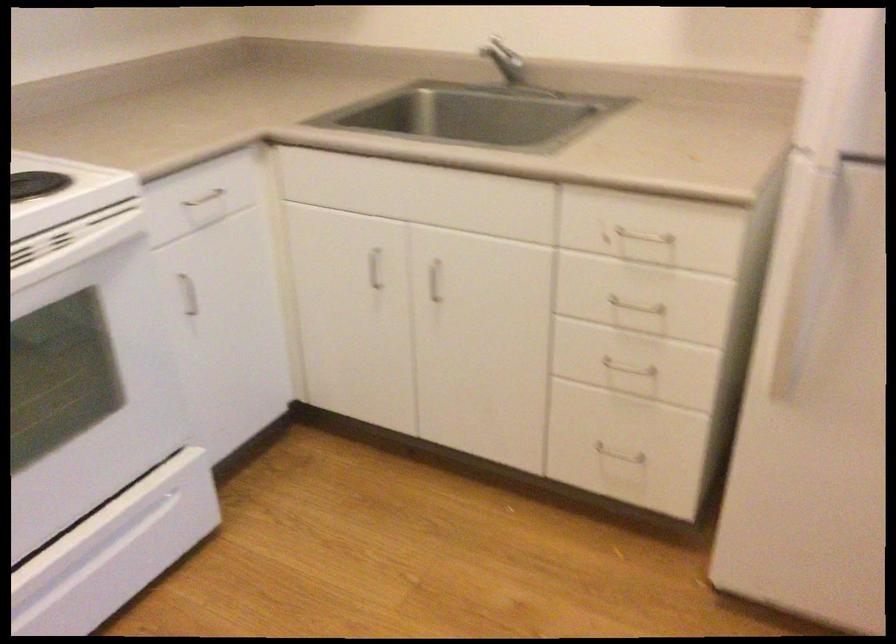
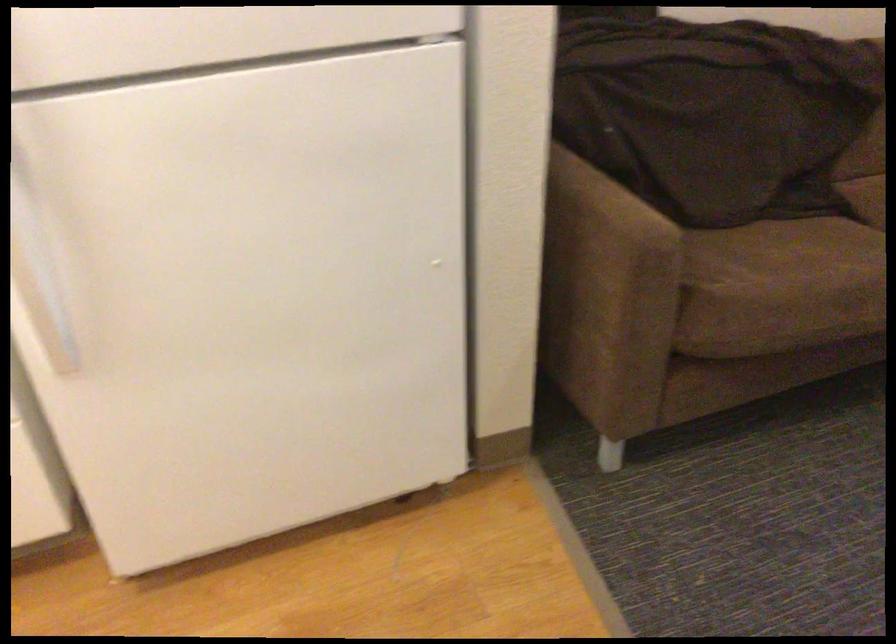
Question: The camera is either moving clockwise (left) or counter-clockwise (right) around the object. The first image is from the beginning of the video and the second image is from the end. Is the camera moving left or right when shooting the video?

Choices:
 (A) Left
 (B) Right

Answer: (A)